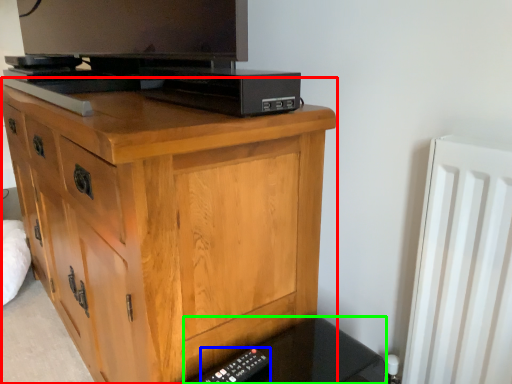
Question: Based on their relative distances, which object is farther from chest of drawers (highlighted by a red box)? Choose from remote (highlighted by a blue box) and vanity (highlighted by a green box).

Choices:
 (A) remote
 (B) vanity

Answer: (A)